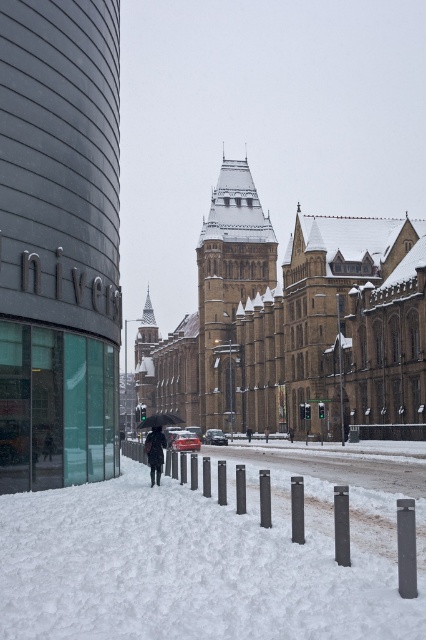
You are standing in the snowy urban scene and want to take a photo of both the white powdery snow at center and the black matte umbrella at center. Which object should you focus on first to ensure both are in sharp focus?

Since the white powdery snow at center is closer to the viewer than the black matte umbrella at center, you should focus on the white powdery snow at center first. This ensures that both objects will be in focus as the umbrella is further away and within the depth of field.

You are a photographer trying to capture the historic building in the background while including both the dark wool coat at center and the black matte umbrella at center in your shot. Which object should you focus on to ensure both are in frame without zooming in or out?

Since the dark wool coat at center occupies less space than the black matte umbrella at center, you should focus on the black matte umbrella at center to ensure both objects are within the frame without needing to adjust the zoom.

You are a delivery person trying to deliver a package to the historic building. You see the white powdery snow at center and the dark wool coat at center. Which object is closer to the ground?

The white powdery snow at center is located below dark wool coat at center, so it is closer to the ground.